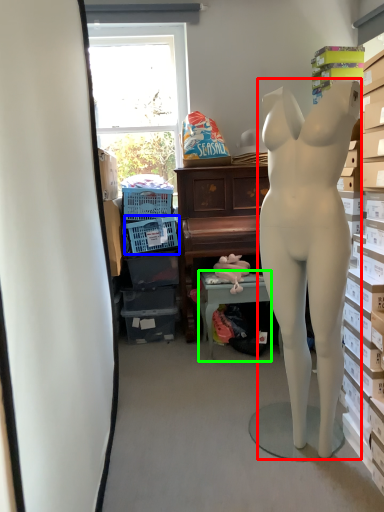
Question: Which is nearer to the person (highlighted by a red box)? laundry basket (highlighted by a blue box) or table (highlighted by a green box).

Choices:
 (A) laundry basket
 (B) table

Answer: (B)